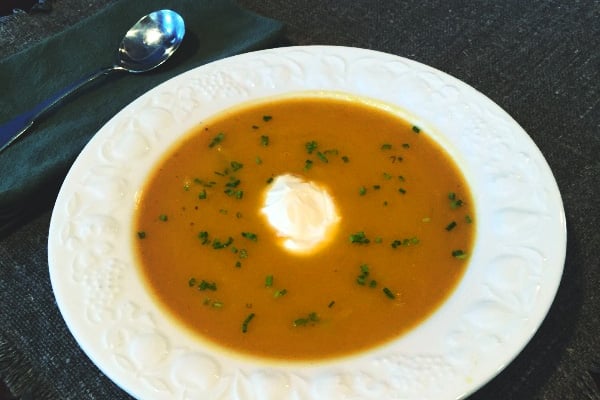
Locate an element on the screen. The width and height of the screenshot is (600, 400). spoon is located at coordinates (161, 32), (141, 47), (132, 35), (162, 16), (168, 43), (101, 72), (43, 110).